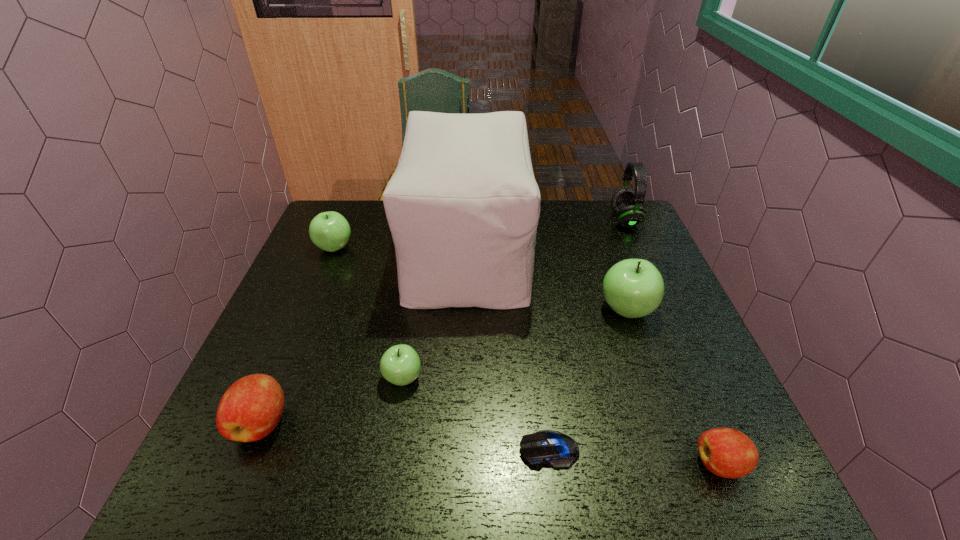
Find the location of a particular element. headset at the right edge is located at coordinates (626, 203).

You are a GUI agent. You are given a task and a screenshot of the screen. Output one action in this format:
    pyautogui.click(x=<x>, y=<y>)
    Task: Click on the object that is positioned at the far left corner
    
    Given the screenshot: What is the action you would take?
    pyautogui.click(x=330, y=231)

Identify the location of object at the far right corner. (626, 203).

You are a GUI agent. You are given a task and a screenshot of the screen. Output one action in this format:
    pyautogui.click(x=<x>, y=<y>)
    Task: Click on the object located at the near right corner
    The image size is (960, 540).
    Given the screenshot: What is the action you would take?
    pyautogui.click(x=729, y=453)

Find the location of a particular element. The width and height of the screenshot is (960, 540). free spot at the far edge of the desktop is located at coordinates (550, 239).

You are a GUI agent. You are given a task and a screenshot of the screen. Output one action in this format:
    pyautogui.click(x=<x>, y=<y>)
    Task: Click on the vacant space at the near edge of the desktop
    Image resolution: width=960 pixels, height=540 pixels.
    Given the screenshot: What is the action you would take?
    pyautogui.click(x=501, y=461)

The height and width of the screenshot is (540, 960). In order to click on free spot at the left edge of the desktop in this screenshot , I will do `click(293, 295)`.

Image resolution: width=960 pixels, height=540 pixels. I want to click on vacant space at the right edge of the desktop, so click(x=669, y=336).

Image resolution: width=960 pixels, height=540 pixels. What are the coordinates of `free space at the far right corner` in the screenshot? It's located at (604, 201).

Where is `free space between the third apple from right to left and the leftmost green apple`? The image size is (960, 540). free space between the third apple from right to left and the leftmost green apple is located at coordinates (369, 313).